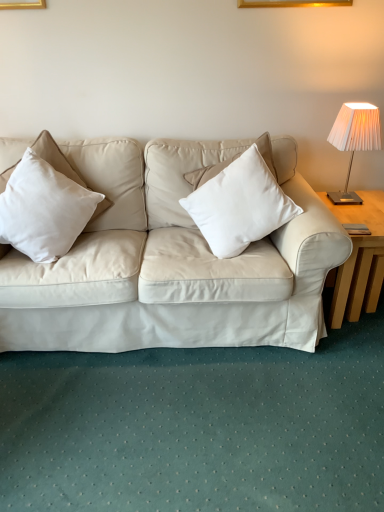
This screenshot has height=512, width=384. Identify the location of free space above white pleated fabric lampshade at upper right (from a real-world perspective). tap(365, 106).